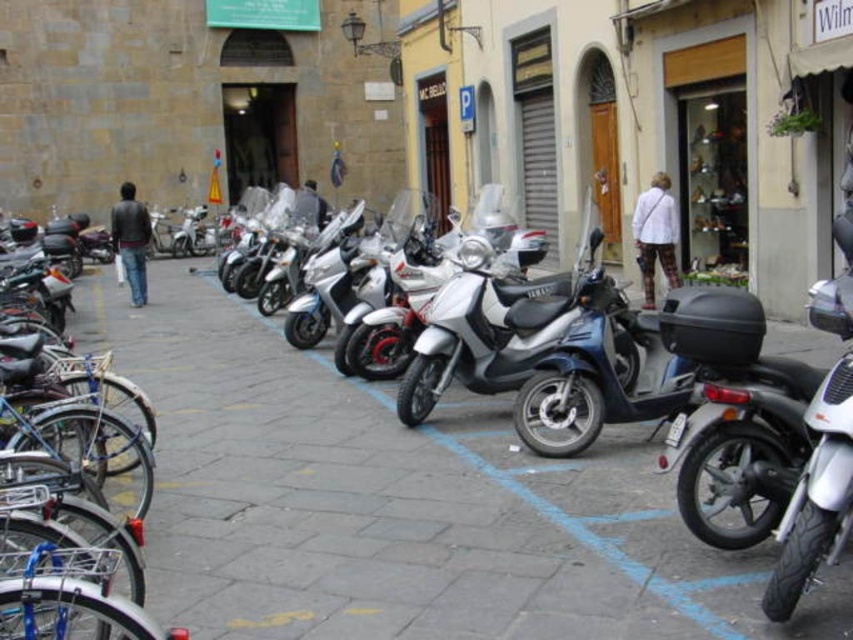
Question: Which point is farther to the camera?

Choices:
 (A) (160, 602)
 (B) (555, 324)

Answer: (B)

Question: Can you confirm if matte gray pavement at center is smaller than metallic silver scooter at center?

Choices:
 (A) no
 (B) yes

Answer: (A)

Question: Which object is closer to the camera taking this photo?

Choices:
 (A) blue matte bicycle at left
 (B) metallic silver scooter at center
 (C) matte gray pavement at center

Answer: (A)

Question: Can you confirm if matte gray pavement at center is wider than metallic silver scooter at center?

Choices:
 (A) no
 (B) yes

Answer: (B)

Question: Which object is the farthest from the matte gray pavement at center?

Choices:
 (A) metallic silver scooter at center
 (B) blue matte bicycle at left

Answer: (B)

Question: Does matte gray pavement at center come in front of blue matte bicycle at left?

Choices:
 (A) no
 (B) yes

Answer: (A)